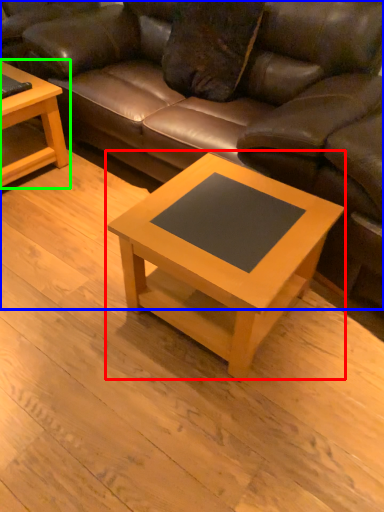
Question: Which object is positioned farthest from coffee table (highlighted by a red box)? Select from studio couch (highlighted by a blue box) and coffee table (highlighted by a green box).

Choices:
 (A) studio couch
 (B) coffee table

Answer: (B)